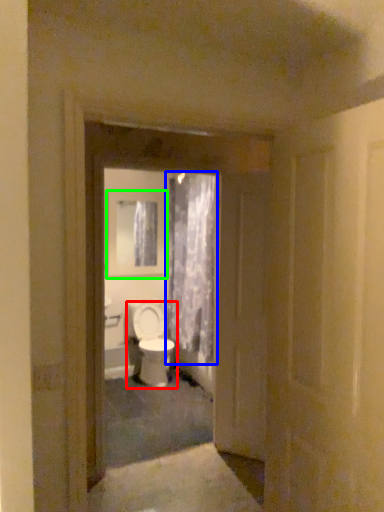
Question: Estimate the real-world distances between objects in this image. Which object is closer to toilet (highlighted by a red box), curtain (highlighted by a blue box) or medicine cabinet (highlighted by a green box)?

Choices:
 (A) curtain
 (B) medicine cabinet

Answer: (A)